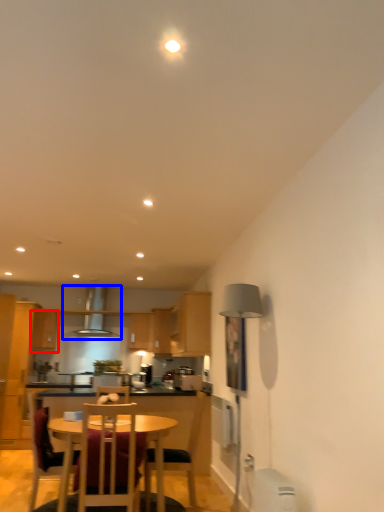
Question: Which of the following is the farthest to the observer, cabinetry (highlighted by a red box) or exhaust hood (highlighted by a blue box)?

Choices:
 (A) cabinetry
 (B) exhaust hood

Answer: (B)